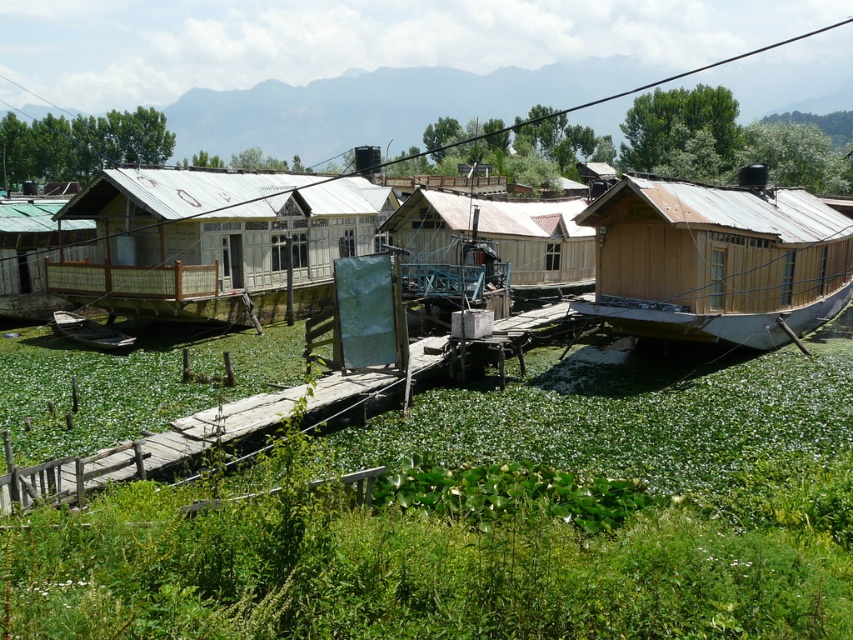
You are standing at the point marked by the coordinates point (x=216, y=241) in the lakeside scene. What object are you directly at?

The point (x=216, y=241) marks the white wooden house at center.

You are standing at the point with coordinates (216, 241) in the lakeside scene. Which object are you currently at?

You are at the white wooden house at center.

From the picture: You are standing at the wooden bridge and want to walk towards the metal gate. Which point, point (x=231, y=182) or point (x=704, y=250), is closer to you as you approach the gate?

Point (x=231, y=182) is closer to you because it is further to the viewer than point (x=704, y=250), meaning it is nearer in the scene.